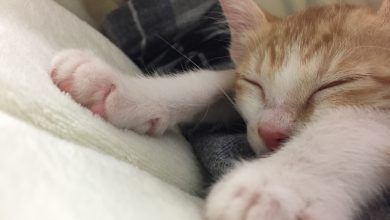
The height and width of the screenshot is (220, 390). Identify the location of gray checked blanket. (182, 30).